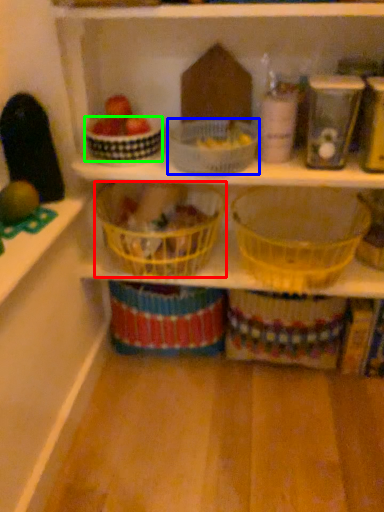
Question: Estimate the real-world distances between objects in this image. Which object is closer to basket (highlighted by a red box), basket (highlighted by a blue box) or basket (highlighted by a green box)?

Choices:
 (A) basket
 (B) basket

Answer: (A)